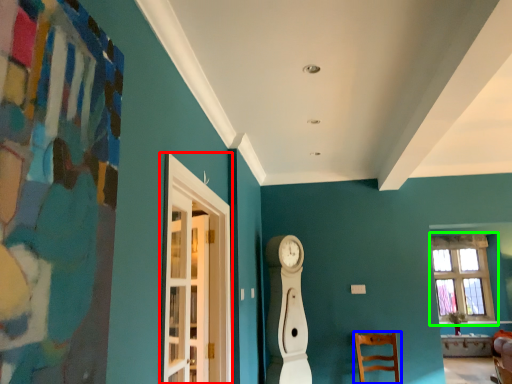
Question: Which is nearer to the glass door (highlighted by a red box)? chair (highlighted by a blue box) or window (highlighted by a green box).

Choices:
 (A) chair
 (B) window

Answer: (A)